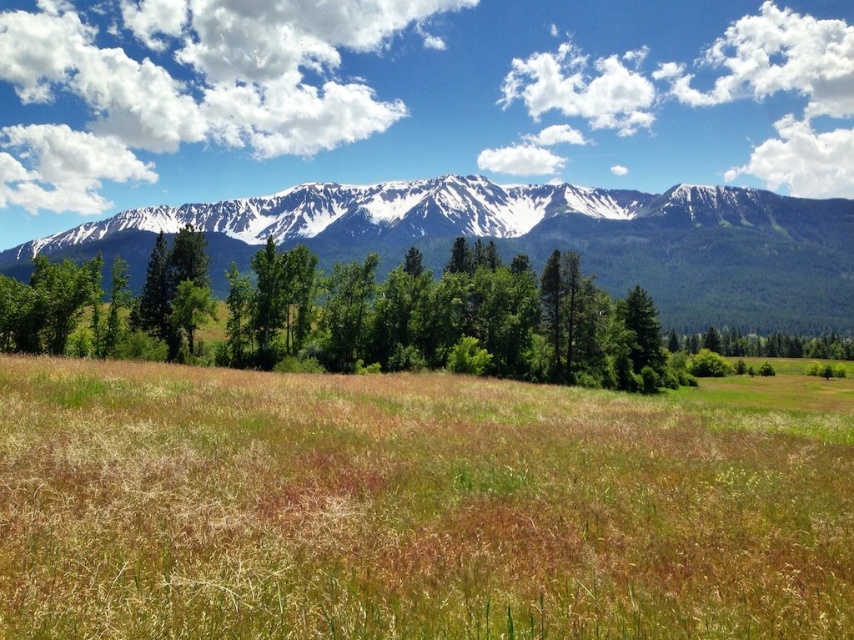
Is brown grassland at center positioned in front of snowy granite mountain range at upper center?

Yes, brown grassland at center is in front of snowy granite mountain range at upper center.

Which is more to the right, brown grassland at center or snowy granite mountain range at upper center?

brown grassland at center

Is point (695, 460) positioned before point (393, 195)?

Yes.

Locate an element on the screen. brown grassland at center is located at coordinates [416, 506].